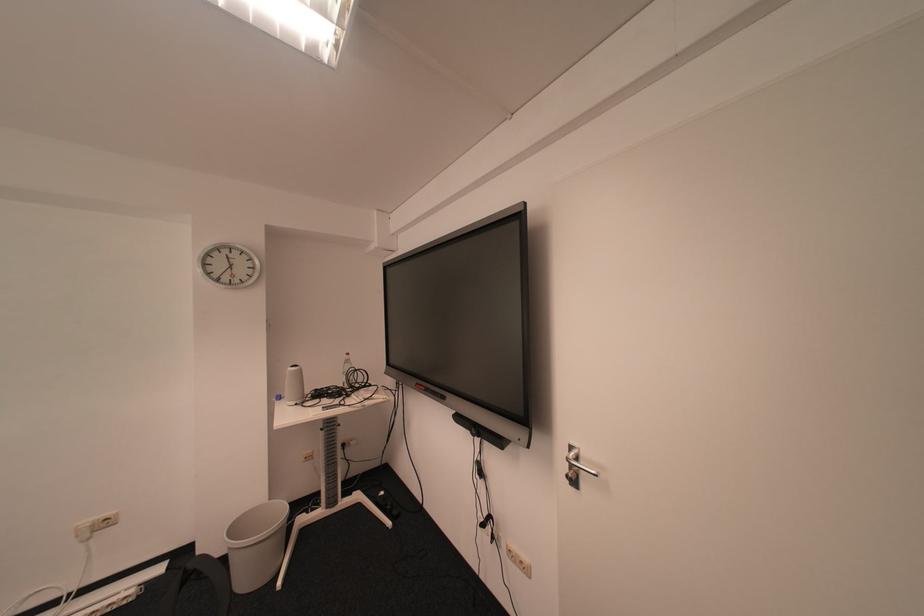
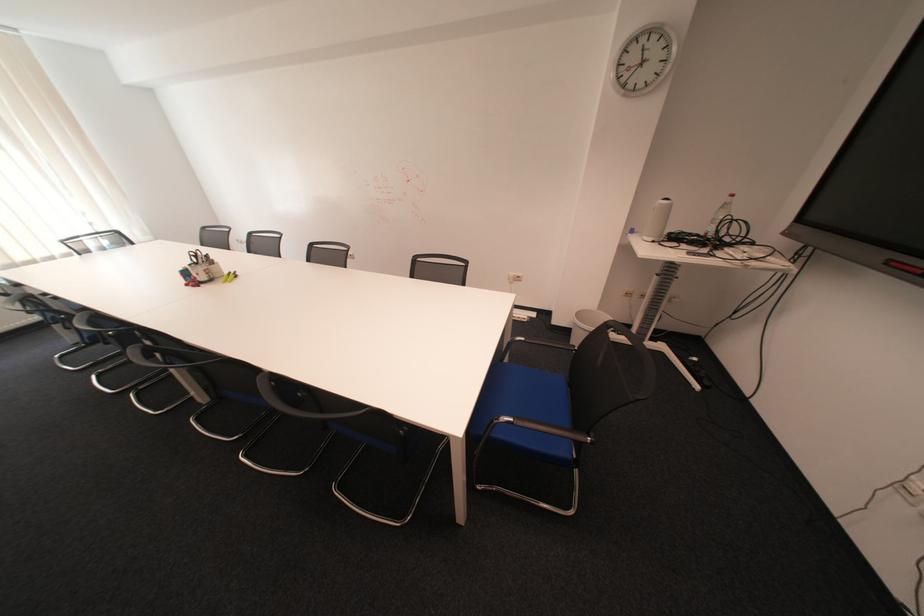
Where in the second image is the point corresponding to pixel 246 528 from the first image?

(590, 315)